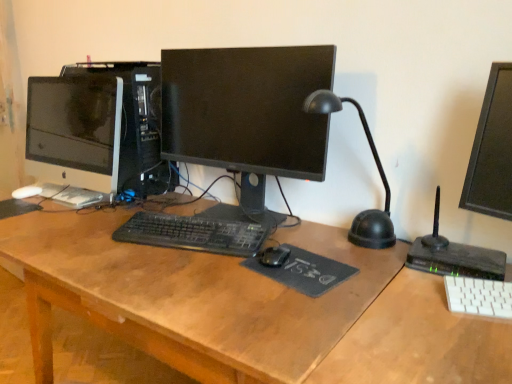
The image size is (512, 384). I want to click on vacant area on top of black fabric mousepad at center, positioned as the 2th mousepad in back-to-front order (from a real-world perspective), so click(289, 254).